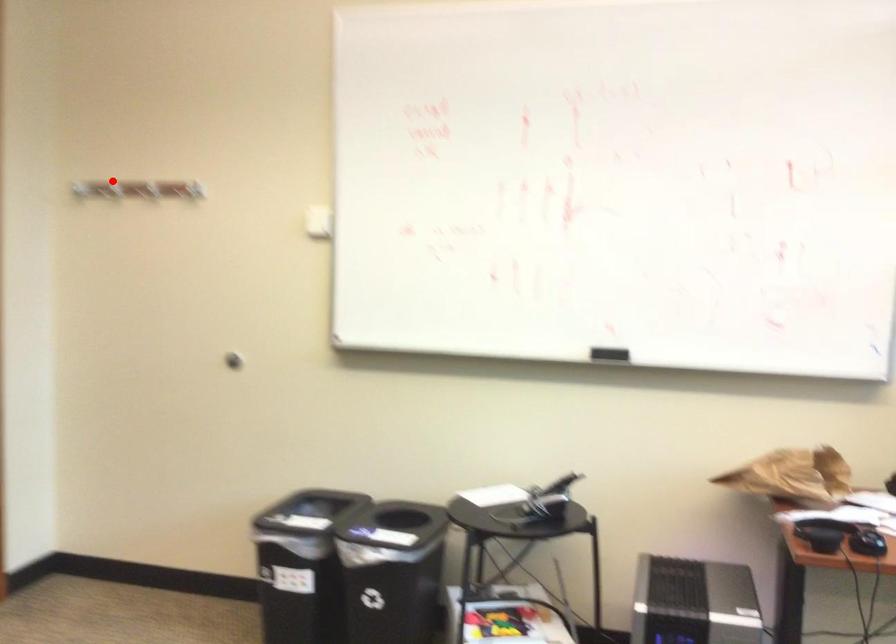
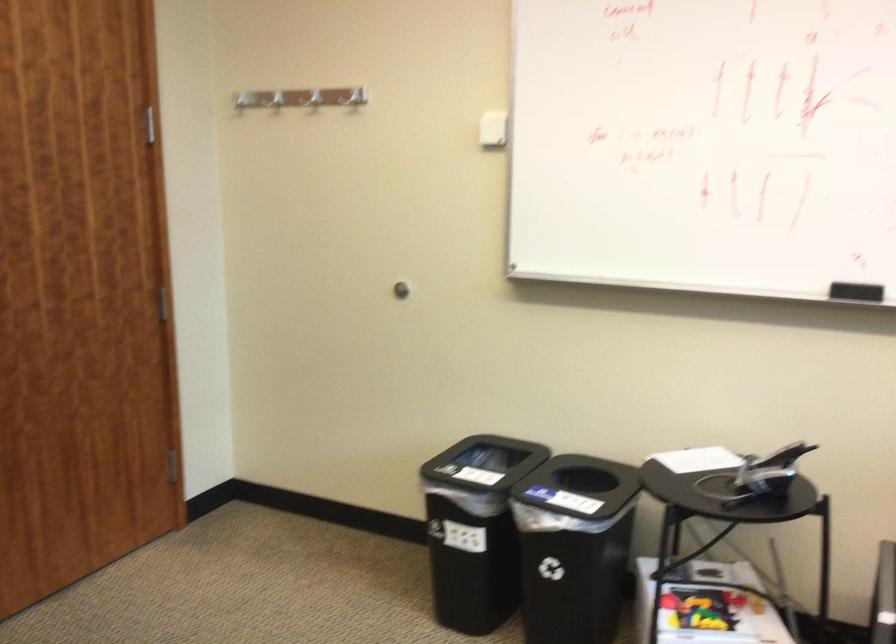
Find the pixel in the second image that matches the highlighted location in the first image.

(277, 99)